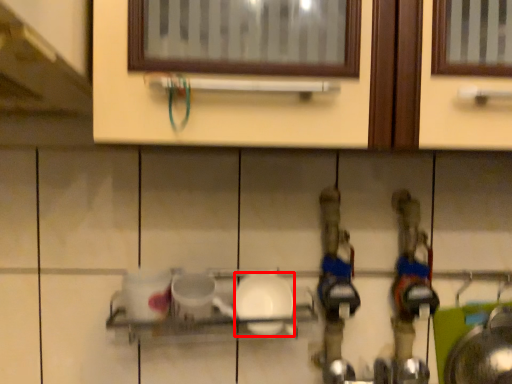
Question: From the image, what is the correct spatial relationship of tableware (annotated by the red box) in relation to shelf?

Choices:
 (A) left
 (B) right

Answer: (B)